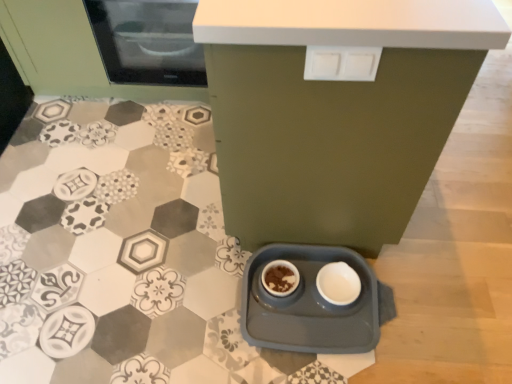
I want to click on free location to the left of gray plastic tray at lower center, so click(192, 298).